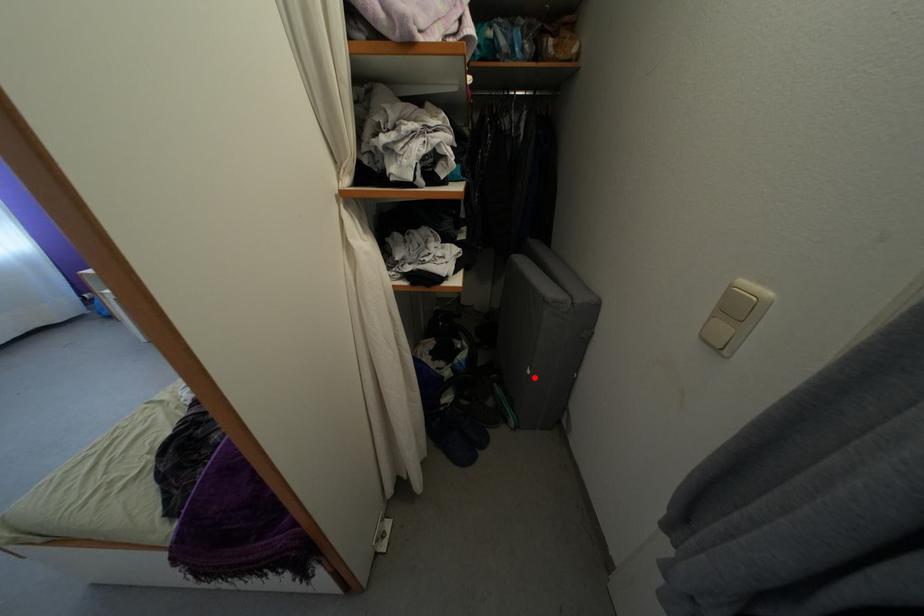
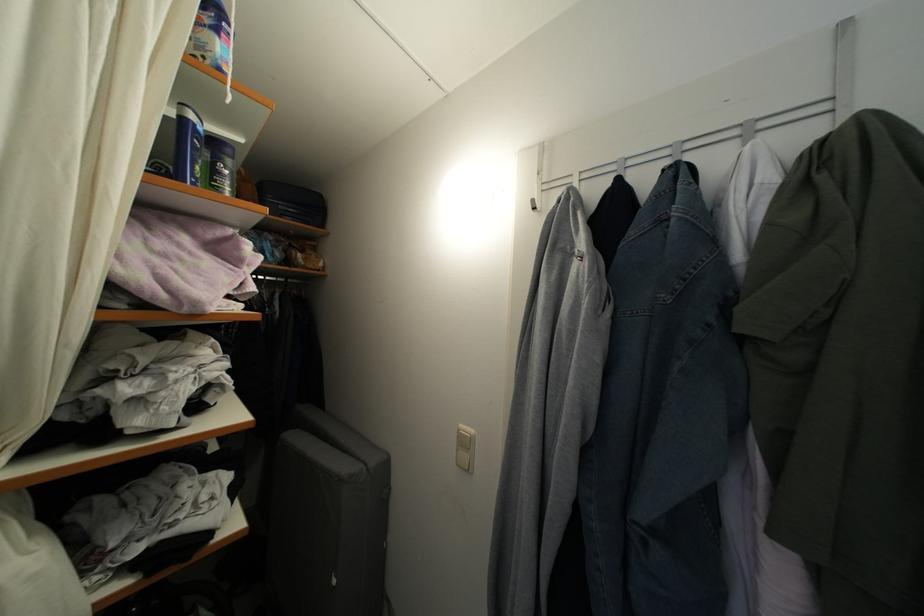
Find the pixel in the second image that matches the highlighted location in the first image.

(339, 588)